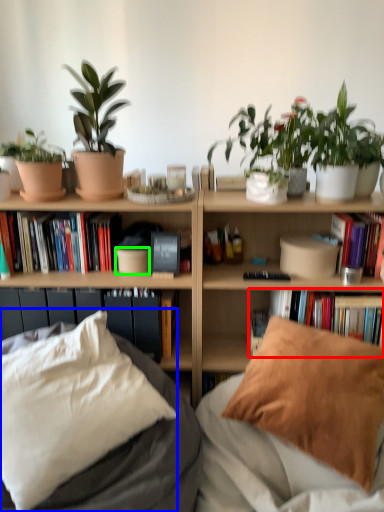
Question: Which object is the farthest from book (highlighted by a red box)? Choose among these: pillow (highlighted by a blue box) or flowerpot (highlighted by a green box).

Choices:
 (A) pillow
 (B) flowerpot

Answer: (A)